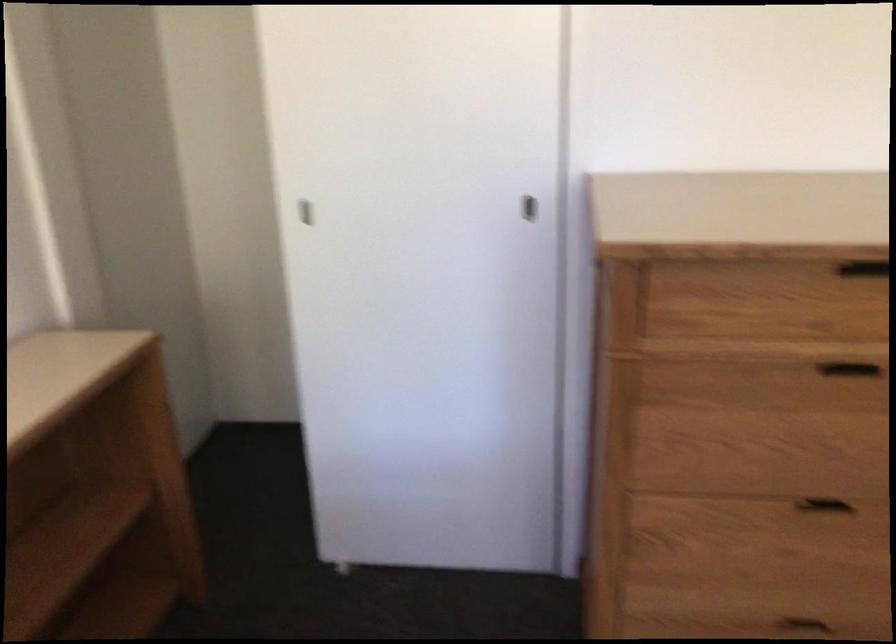
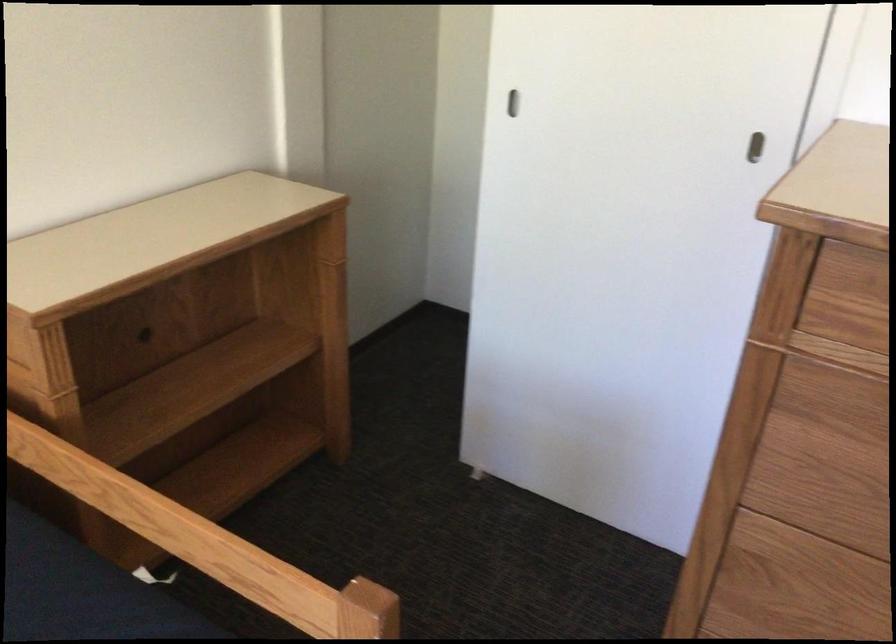
In the second image, find the point that corresponds to point 528,207 in the first image.

(754, 147)